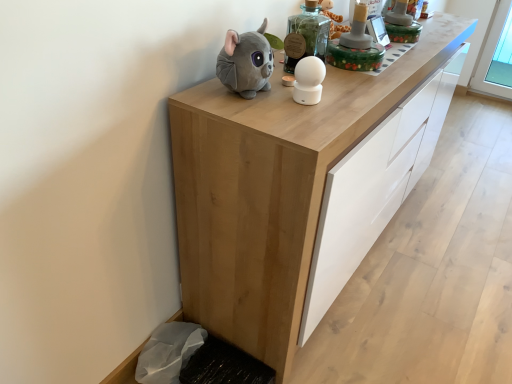
This screenshot has height=384, width=512. Identify the location of blank space to the left of white matte ball at center, which is the 2th toy in left-to-right order. (253, 101).